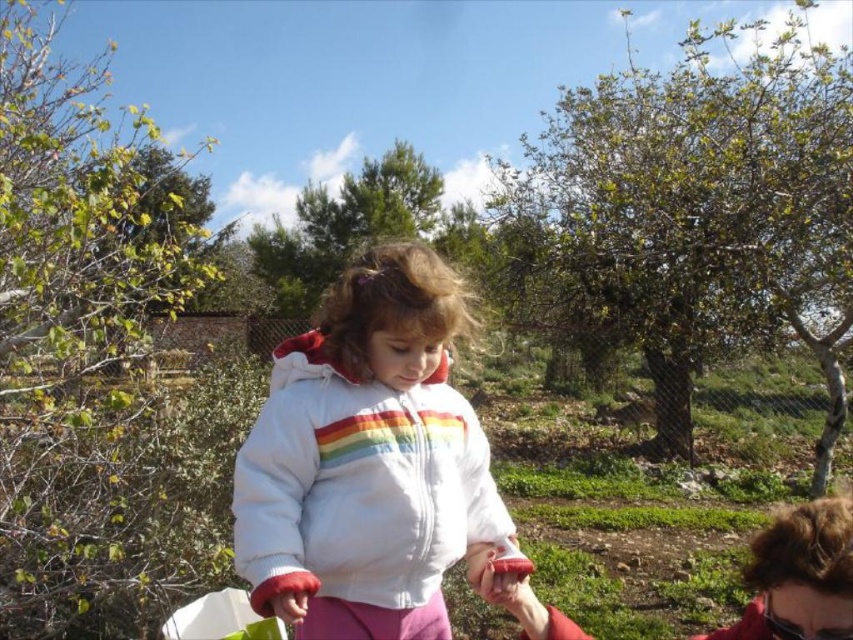
Question: Is white fleece jacket at center smaller than matte red sweater at lower right?

Choices:
 (A) yes
 (B) no

Answer: (B)

Question: Can you confirm if white fleece jacket at center is smaller than matte red sweater at lower right?

Choices:
 (A) yes
 (B) no

Answer: (B)

Question: Where is white fleece jacket at center located in relation to matte red sweater at lower right in the image?

Choices:
 (A) left
 (B) right

Answer: (A)